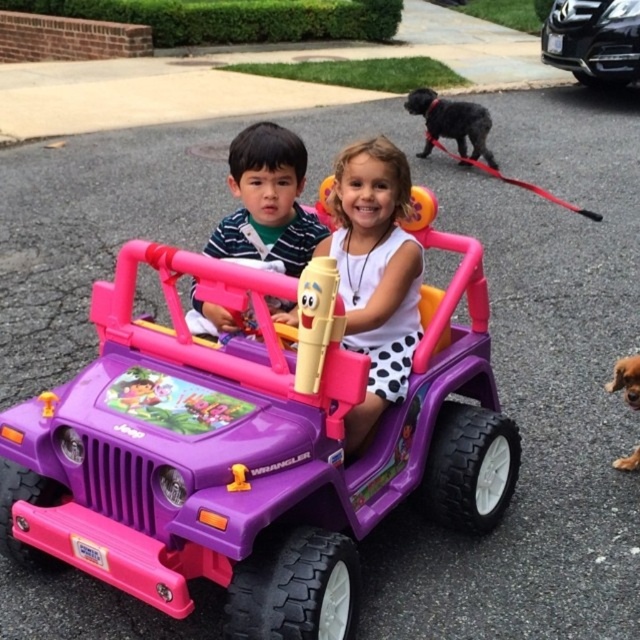
You are standing in front of the purple plastic toy car at center. What is the position of the point marked at coordinates [248,449] relative to the car?

The point marked at coordinates [248,449] is located at the center of the purple plastic toy car.